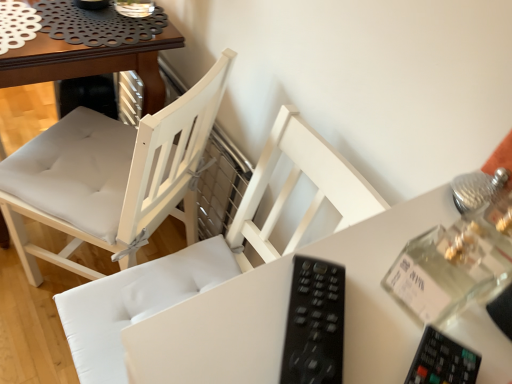
Describe the element at coordinates (209, 251) in the screenshot. I see `white wood chair at center, which ranks as the 1th chair in right-to-left order` at that location.

At what (x,y) coordinates should I click in order to perform the action: click on black plastic remote at center. Please return your answer as a coordinate pair (x, y). The height and width of the screenshot is (384, 512). Looking at the image, I should click on (314, 324).

Find the location of a particular element. white fabric chair at center, which ranks as the first chair in left-to-right order is located at coordinates (110, 175).

Between white fabric chair at center, which ranks as the first chair in left-to-right order, and white wood chair at center, which ranks as the 1th chair in right-to-left order, which one has smaller width?

Thinner between the two is white wood chair at center, which ranks as the 1th chair in right-to-left order.

From a real-world perspective, is white fabric chair at center, the 2th chair from the right, below white wood chair at center, placed as the second chair when sorted from left to right?

Yes.

Based on their positions, is white fabric chair at center, which ranks as the first chair in left-to-right order, located to the left or right of white wood chair at center, placed as the second chair when sorted from left to right?

Based on their positions, white fabric chair at center, which ranks as the first chair in left-to-right order, is located to the left of white wood chair at center, placed as the second chair when sorted from left to right.

From a real-world perspective, is black plastic remote at center physically below white wood chair at center, which ranks as the 1th chair in right-to-left order?

No, from a real-world perspective, black plastic remote at center is not under white wood chair at center, which ranks as the 1th chair in right-to-left order.

Who is bigger, black plastic remote at center or white wood chair at center, which ranks as the 1th chair in right-to-left order?

With larger size is white wood chair at center, which ranks as the 1th chair in right-to-left order.

Does black plastic remote at center turn towards white wood chair at center, which ranks as the 1th chair in right-to-left order?

No, black plastic remote at center does not turn towards white wood chair at center, which ranks as the 1th chair in right-to-left order.

Which chair is the 2nd one when counting from the left side of the black plastic remote at center? Please provide its 2D coordinates.

[(110, 175)]

From a real-world perspective, which object rests below the other?

white fabric chair at center, the 2th chair from the right.

Considering the relative positions of black plastic remote at center and white fabric chair at center, which ranks as the first chair in left-to-right order, in the image provided, is black plastic remote at center to the right of white fabric chair at center, which ranks as the first chair in left-to-right order, from the viewer's perspective?

Indeed, black plastic remote at center is positioned on the right side of white fabric chair at center, which ranks as the first chair in left-to-right order.

Considering the positions of point (321, 151) and point (297, 341), is point (321, 151) closer or farther from the camera than point (297, 341)?

Clearly, point (321, 151) is more distant from the camera than point (297, 341).

Considering the sizes of objects white wood chair at center, which ranks as the 1th chair in right-to-left order, and black plastic remote at center in the image provided, who is thinner, white wood chair at center, which ranks as the 1th chair in right-to-left order, or black plastic remote at center?

With smaller width is black plastic remote at center.

How different are the orientations of white wood chair at center, placed as the second chair when sorted from left to right, and black plastic remote at center in degrees?

They differ by 41.2 degrees in their facing directions.

Where is `chair located below the black plastic remote at center (from the image's perspective)`? chair located below the black plastic remote at center (from the image's perspective) is located at coordinates (209, 251).

Does white fabric chair at center, which ranks as the first chair in left-to-right order, have a greater width compared to black plastic remote at center?

Correct, the width of white fabric chair at center, which ranks as the first chair in left-to-right order, exceeds that of black plastic remote at center.

From a real-world perspective, is white fabric chair at center, which ranks as the first chair in left-to-right order, physically located above or below black plastic remote at center?

white fabric chair at center, which ranks as the first chair in left-to-right order, is situated lower than black plastic remote at center in the real world.

Which is more to the right, white fabric chair at center, the 2th chair from the right, or black plastic remote at center?

black plastic remote at center is more to the right.

Which point is more distant from viewer, (292,186) or (89,133)?

Positioned behind is point (89,133).

Based on the photo, between white wood chair at center, which ranks as the 1th chair in right-to-left order, and white fabric chair at center, which ranks as the first chair in left-to-right order, which one has larger size?

white fabric chair at center, which ranks as the first chair in left-to-right order, is bigger.

Is white wood chair at center, which ranks as the 1th chair in right-to-left order, touching white fabric chair at center, which ranks as the first chair in left-to-right order?

No, white wood chair at center, which ranks as the 1th chair in right-to-left order, is not in contact with white fabric chair at center, which ranks as the first chair in left-to-right order.

Which object is further away from the camera taking this photo, white wood chair at center, placed as the second chair when sorted from left to right, or white fabric chair at center, the 2th chair from the right?

Positioned behind is white fabric chair at center, the 2th chair from the right.

Where is `chair in front of the white fabric chair at center, which ranks as the first chair in left-to-right order`? chair in front of the white fabric chair at center, which ranks as the first chair in left-to-right order is located at coordinates (209, 251).

From a real-world perspective, count 1st chairs downward from the black plastic remote at center and point to it. Please provide its 2D coordinates.

[(209, 251)]

Based on their spatial positions, is black plastic remote at center or white wood chair at center, placed as the second chair when sorted from left to right, further from white fabric chair at center, which ranks as the first chair in left-to-right order?

black plastic remote at center.

From the image, which object appears to be farther from white fabric chair at center, the 2th chair from the right, white wood chair at center, placed as the second chair when sorted from left to right, or black plastic remote at center?

black plastic remote at center is positioned further to the anchor white fabric chair at center, the 2th chair from the right.

Looking at the image, which one is located further to white wood chair at center, placed as the second chair when sorted from left to right, black plastic remote at center or white fabric chair at center, which ranks as the first chair in left-to-right order?

black plastic remote at center lies further to white wood chair at center, placed as the second chair when sorted from left to right, than the other object.

Estimate the real-world distances between objects in this image. Which object is closer to white wood chair at center, placed as the second chair when sorted from left to right, white fabric chair at center, the 2th chair from the right, or black plastic remote at center?

Among the two, white fabric chair at center, the 2th chair from the right, is located nearer to white wood chair at center, placed as the second chair when sorted from left to right.

When comparing their distances from black plastic remote at center, does white fabric chair at center, the 2th chair from the right, or white wood chair at center, placed as the second chair when sorted from left to right, seem closer?

The object closer to black plastic remote at center is white wood chair at center, placed as the second chair when sorted from left to right.

Estimate the real-world distances between objects in this image. Which object is closer to black plastic remote at center, white wood chair at center, placed as the second chair when sorted from left to right, or white fabric chair at center, the 2th chair from the right?

white wood chair at center, placed as the second chair when sorted from left to right, lies closer to black plastic remote at center than the other object.

Where is `chair located between black plastic remote at center and white fabric chair at center, which ranks as the first chair in left-to-right order, in the depth direction`? This screenshot has width=512, height=384. chair located between black plastic remote at center and white fabric chair at center, which ranks as the first chair in left-to-right order, in the depth direction is located at coordinates (209, 251).